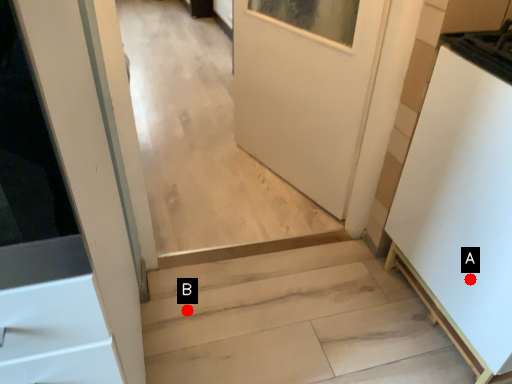
Question: Two points are circled on the image, labeled by A and B beside each circle. Which point appears farthest from the camera in this image?

Choices:
 (A) A is further
 (B) B is further

Answer: (B)